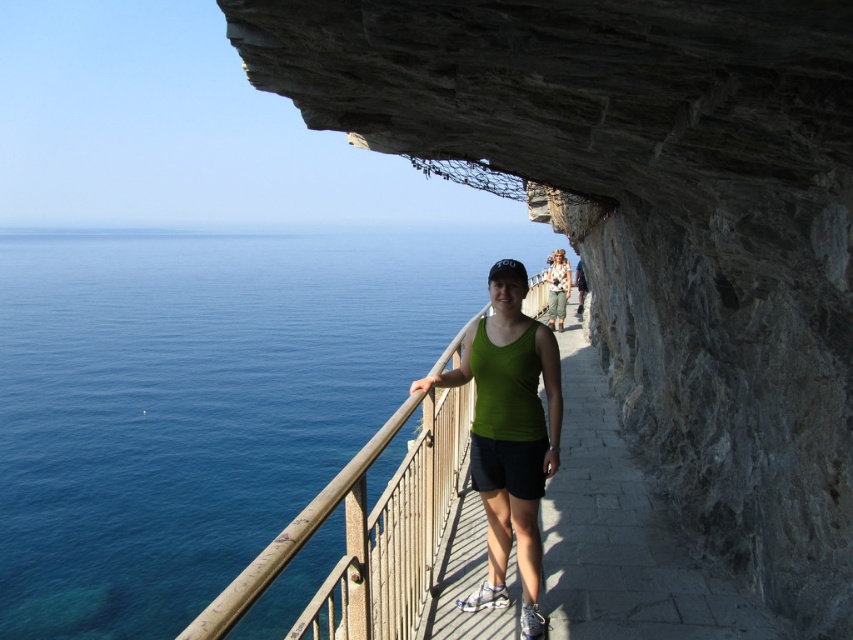
You are a photographer trying to capture a photo of the gray stone cliff at upper center and the floral fabric shirt at center. Based on their positions, which object should you focus on first if you want to ensure both are in sharp focus?

The gray stone cliff at upper center is below the floral fabric shirt at center, so you should focus on the gray stone cliff at upper center first to ensure both are in sharp focus.

You are a photographer trying to capture a photo of the gray stone cliff at upper center and the floral fabric shirt at center. Based on their positions, which object should you adjust your camera to focus on first if you want to include both in the frame?

The gray stone cliff at upper center is to the left of the floral fabric shirt at center, so you should focus on the gray stone cliff at upper center first to ensure both are in the frame.

You are a photographer planning to take a wide shot of the coastal path scene. You want to ensure that both the blue liquid water at left and the floral fabric shirt at center are clearly visible. Given their sizes, which object should you prioritize focusing on to ensure it doesn t get lost in the frame?

The blue liquid water at left is larger in size than the floral fabric shirt at center, so you should prioritize focusing on the floral fabric shirt at center to ensure it doesn t get lost in the frame.